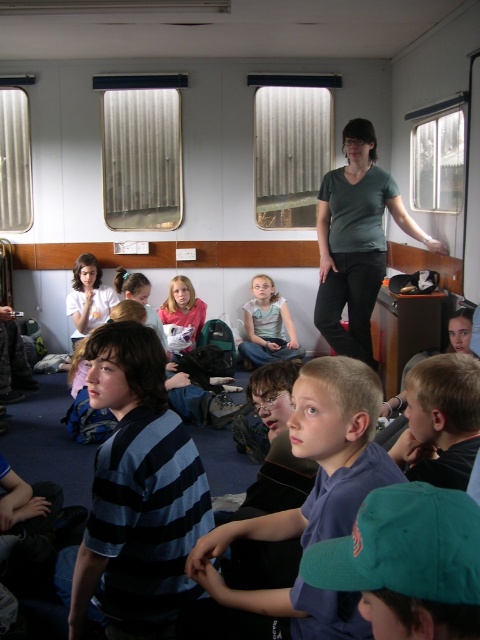
Can you confirm if striped cotton shirt at center is taller than matte pink shirt at center?

Correct, striped cotton shirt at center is much taller as matte pink shirt at center.

Can you confirm if striped cotton shirt at center is bigger than matte pink shirt at center?

Yes.

Is point (132, 595) positioned behind point (192, 304)?

No, it is not.

Locate an element on the screen. striped cotton shirt at center is located at coordinates (135, 493).

Who is more distant from viewer, (466,442) or (262,288)?

Positioned behind is point (262,288).

Is blonde hair at center closer to the viewer compared to light blue fabric shirt at center?

Yes, blonde hair at center is closer to the viewer.

Between point (456, 356) and point (261, 364), which one is positioned in front?

Point (456, 356) is more forward.

The width and height of the screenshot is (480, 640). What are the coordinates of `blonde hair at center` in the screenshot? It's located at (441, 420).

Which is below, striped cotton shirt at center or light blue fabric shirt at center?

striped cotton shirt at center is lower down.

Is striped cotton shirt at center shorter than light blue fabric shirt at center?

No, striped cotton shirt at center is not shorter than light blue fabric shirt at center.

Between point (148, 412) and point (272, 337), which one is positioned in front?

Positioned in front is point (148, 412).

What are the coordinates of `striped cotton shirt at center` in the screenshot? It's located at (135, 493).